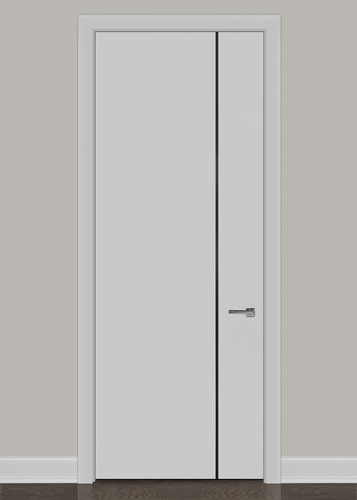
Locate an element on the screen. This screenshot has height=500, width=357. right trim is located at coordinates [x=320, y=472].